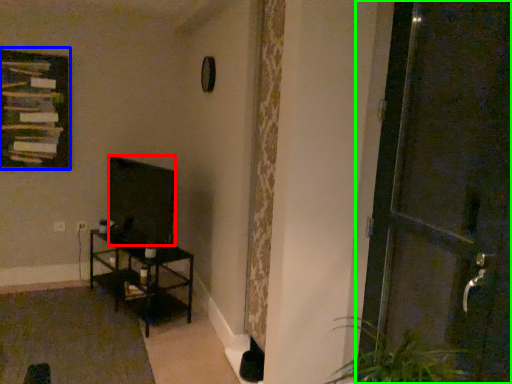
Question: Based on their relative distances, which object is farther from wide (highlighted by a red box)? Choose from picture frame (highlighted by a blue box) and door (highlighted by a green box).

Choices:
 (A) picture frame
 (B) door

Answer: (B)